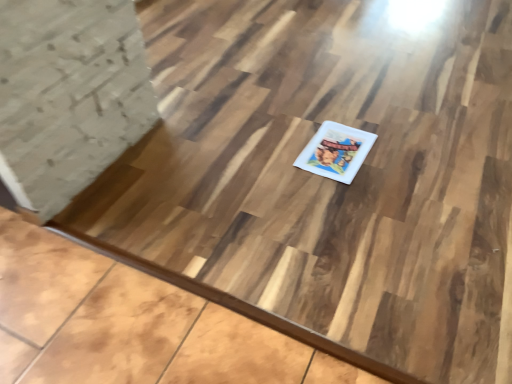
I want to click on vacant area located to the right-hand side of white glossy book at center, so click(x=399, y=150).